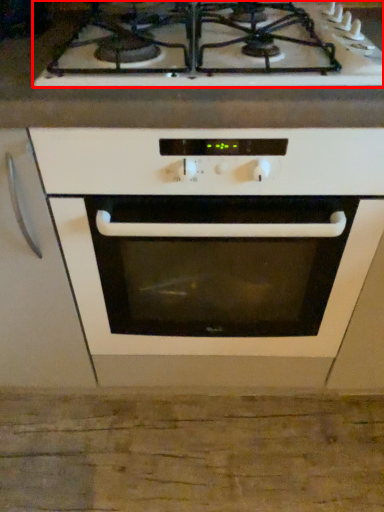
Question: From the image's perspective, what is the correct spatial relationship of gas stove (annotated by the red box) in relation to oven?

Choices:
 (A) above
 (B) below

Answer: (A)